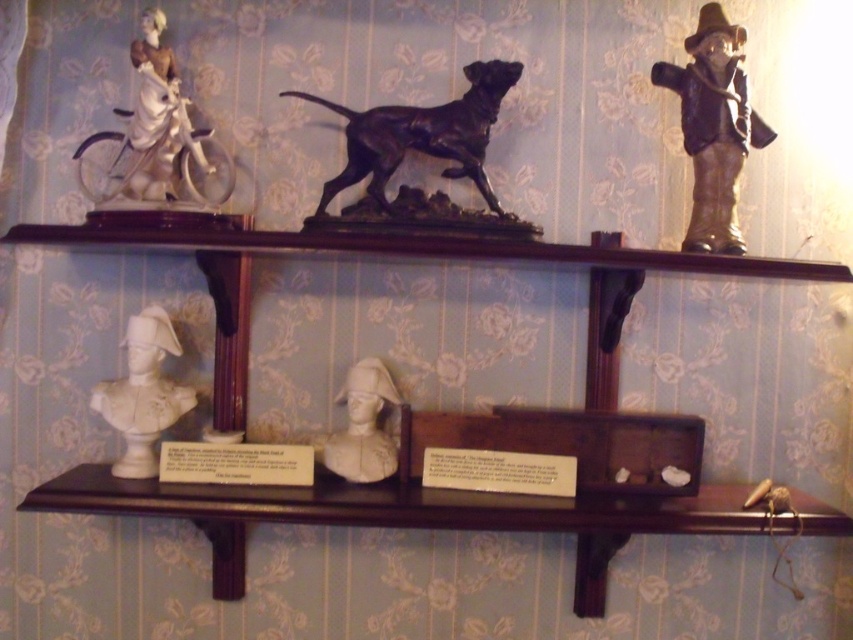
Question: Which is nearer to the bronze figurine at upper right?

Choices:
 (A) white glossy bust at center
 (B) shiny black statue at center
 (C) white porcelain bust at center
 (D) white porcelain figure at upper left

Answer: (B)

Question: Is white glossy bust at center positioned before white porcelain bust at center?

Choices:
 (A) no
 (B) yes

Answer: (B)

Question: Is bronze figurine at upper right to the right of white glossy bust at center from the viewer's perspective?

Choices:
 (A) yes
 (B) no

Answer: (A)

Question: In this image, where is white glossy bust at center located relative to white porcelain bust at center?

Choices:
 (A) left
 (B) right

Answer: (A)

Question: Which object appears farthest from the camera in this image?

Choices:
 (A) white porcelain bust at center
 (B) white glossy bust at center
 (C) shiny black statue at center

Answer: (A)

Question: Which point appears farthest from the camera in this image?

Choices:
 (A) (383, 369)
 (B) (496, 202)

Answer: (A)